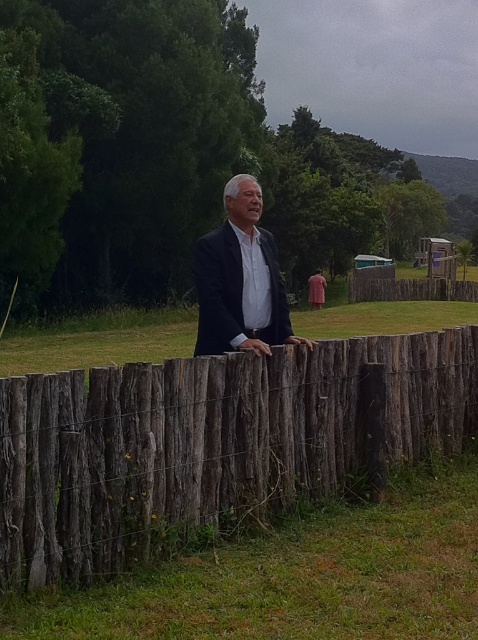
In the scene shown: You are a fashion designer observing a man dressed in a matte black suit at center and a pink fabric at center. Which item of clothing is larger?

The pink fabric at center is larger than the matte black suit at center.

You are standing in the garden and see the weathered wood fence at center and the pink fabric at center. Which object is closer to you?

The weathered wood fence at center is closer to you because it is in front of the pink fabric at center.

You are a painter who wants to paint the weathered wood fence at center and the matte black suit at center in the scene. Which object requires more paint due to its larger surface area?

The weathered wood fence at center requires more paint because its width surpasses that of the matte black suit at center, indicating a larger surface area.